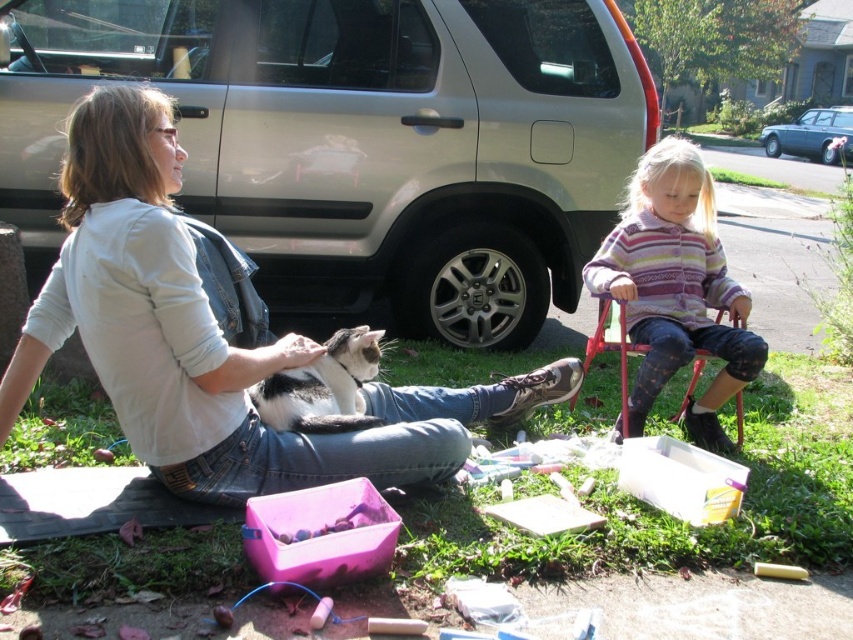
You are a delivery person approaching the driveway where the silver metallic suv at center and the teal metallic sedan at upper right are parked. Which vehicle should you approach first if you need to deliver a package to the one closer to the entrance?

You should approach the silver metallic suv at center first because it is closer to the viewer, which likely means it is nearer to the entrance compared to the teal metallic sedan at upper right that is farther away.